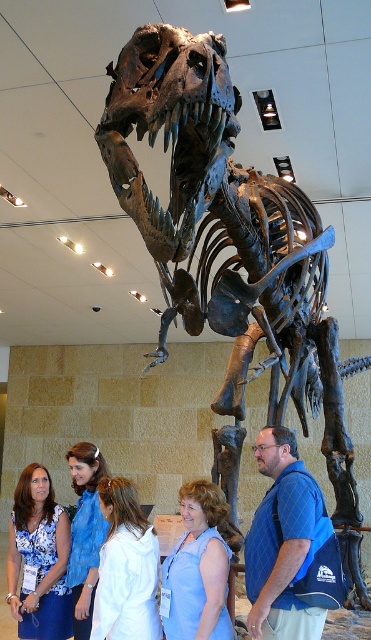
You are a visitor at the museum and want to take a photo of the rusty metal skeleton at center without the blue floral blouse at lower left appearing in the shot. Based on their positions, which direction should you move to achieve this?

The rusty metal skeleton at center is positioned on the right side of the blue floral blouse at lower left. To avoid the blue floral blouse at lower left in your photo, move to the right side of the rusty metal skeleton at center.

You are standing in a museum and see a point marked at coordinates [232,253]. What object is located at that point?

The point at coordinates [232,253] indicates the rusty metal skeleton at center.

You are a museum guide standing in front of the T. rex skeleton. You notice two visitors wearing the blue floral blouse at lower left and the white fabric shirt at center. If you want to hand out a brochure to both visitors, which visitor would you need to reach up higher to give the brochure to?

The blue floral blouse at lower left is taller than the white fabric shirt at center, so you would need to reach higher to give the brochure to the visitor wearing the blue floral blouse at lower left.